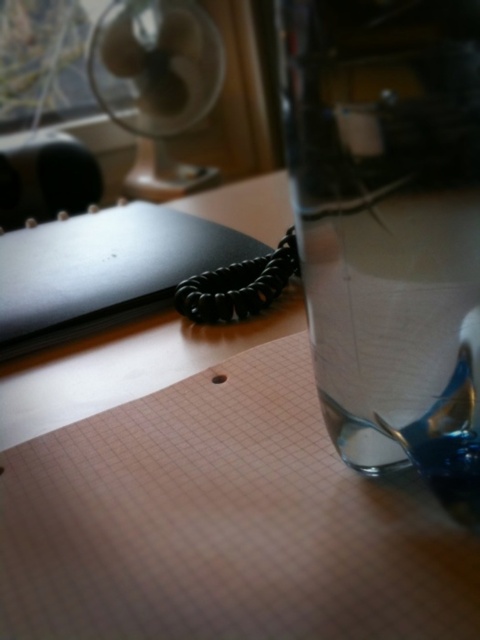
Which is behind, point (156, 300) or point (155, 81)?

The point (155, 81) is behind.

Which is below, matte black notepad at upper left or white plastic fan at upper left?

matte black notepad at upper left is lower down.

At what (x,y) coordinates should I click in order to perform the action: click on matte black notepad at upper left. Please return your answer as a coordinate pair (x, y). Image resolution: width=480 pixels, height=640 pixels. Looking at the image, I should click on (107, 269).

Find the location of a particular element. The height and width of the screenshot is (640, 480). matte black notepad at upper left is located at coordinates (107, 269).

Does transparent glass jar at right have a lesser width compared to matte black notepad at upper left?

Correct, transparent glass jar at right's width is less than matte black notepad at upper left's.

Is point (403, 241) closer to camera compared to point (180, 253)?

That is True.

Is point (443, 19) positioned behind point (252, 298)?

No, it is in front of (252, 298).

Image resolution: width=480 pixels, height=640 pixels. Identify the location of transparent glass jar at right. (383, 204).

Can you confirm if transparent glass jar at right is thinner than white plastic fan at upper left?

Indeed, transparent glass jar at right has a lesser width compared to white plastic fan at upper left.

Based on the photo, does transparent glass jar at right have a larger size compared to white plastic fan at upper left?

No, transparent glass jar at right is not bigger than white plastic fan at upper left.

Who is more forward, (468, 301) or (196, 179)?

Positioned in front is point (468, 301).

Locate an element on the screen. This screenshot has width=480, height=640. transparent glass jar at right is located at coordinates (383, 204).